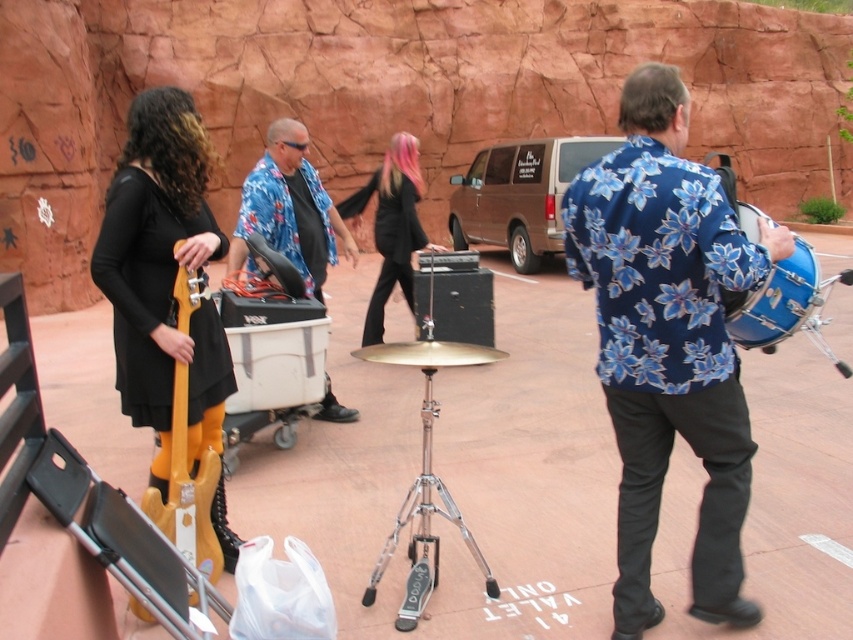
You are a stagehand setting up equipment for the outdoor performance. You need to place the wooden electric guitar at left and the blue metallic drum at right in a straight line from the stage. Given their current positions, which one is closer to the stage if the stage is positioned behind the drummer?

The wooden electric guitar at left is closer to the stage because it is positioned to the left of the blue metallic drum at right, and since the stage is behind the drummer, the guitar would be nearer to the stage area.

In the scene shown: You are a photographer trying to capture a photo of the blue floral shirt at center and the wooden electric guitar at left. Which object should you focus on first to ensure both are in the frame?

The blue floral shirt at center is in front of the wooden electric guitar at left, so you should focus on the wooden electric guitar at left first to ensure both are visible in the frame.